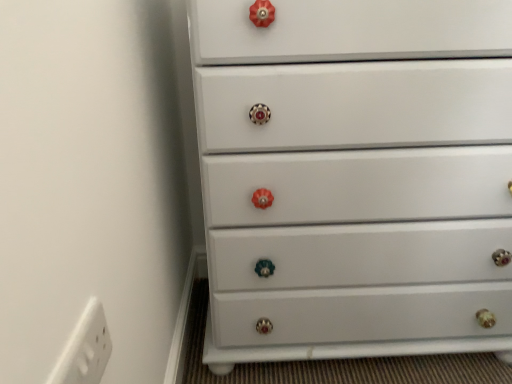
Question: Would you say white glossy chest of drawers at center is inside or outside white plastic outlet at lower left?

Choices:
 (A) outside
 (B) inside

Answer: (A)

Question: Is point (300, 352) closer or farther from the camera than point (61, 355)?

Choices:
 (A) closer
 (B) farther

Answer: (B)

Question: Is white glossy chest of drawers at center in front of or behind white plastic outlet at lower left in the image?

Choices:
 (A) front
 (B) behind

Answer: (B)

Question: Relative to white glossy chest of drawers at center, is white plastic outlet at lower left in front or behind?

Choices:
 (A) behind
 (B) front

Answer: (B)

Question: From a real-world perspective, relative to white glossy chest of drawers at center, is white plastic outlet at lower left vertically above or below?

Choices:
 (A) above
 (B) below

Answer: (A)

Question: Is point (82, 317) closer or farther from the camera than point (314, 51)?

Choices:
 (A) closer
 (B) farther

Answer: (A)

Question: From the image's perspective, relative to white glossy chest of drawers at center, is white plastic outlet at lower left above or below?

Choices:
 (A) below
 (B) above

Answer: (A)